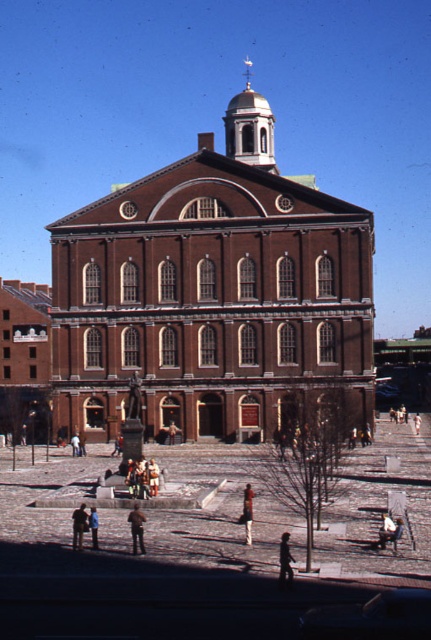
At what (x,y) coordinates should I click in order to perform the action: click on brick plaza at center. Please return your answer as a coordinate pair (x, y). This screenshot has height=640, width=431. Looking at the image, I should click on (190, 556).

Is brick plaza at center further to camera compared to light brown leather jacket at center?

No.

Locate an element on the screen. This screenshot has width=431, height=640. brick plaza at center is located at coordinates (190, 556).

Locate an element on the screen. brick plaza at center is located at coordinates (190, 556).

From the picture: Between silhouette fabric person at lower center and brown leather jacket at center, which one is positioned lower?

silhouette fabric person at lower center is lower down.

Who is taller, silhouette fabric person at lower center or brown leather jacket at center?

brown leather jacket at center is taller.

Between point (284, 572) and point (247, 492), which one is positioned behind?

The point (247, 492) is more distant.

This screenshot has width=431, height=640. Identify the location of silhouette fabric person at lower center. (284, 561).

Between brown leather jacket at center and light brown leather jacket at lower center, which one appears on the right side from the viewer's perspective?

brown leather jacket at center is more to the right.

Is point (249, 493) less distant than point (90, 531)?

No, it is not.

Image resolution: width=431 pixels, height=640 pixels. I want to click on brown leather jacket at center, so click(x=247, y=513).